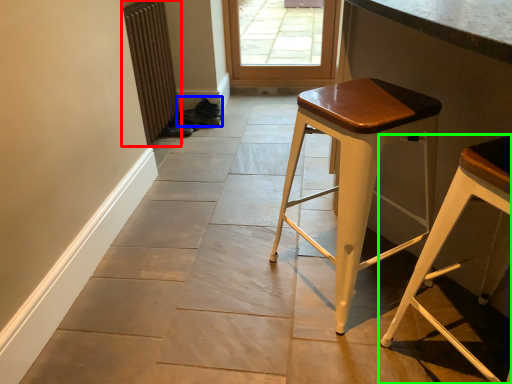
Question: Which object is the closest to the radiator (highlighted by a red box)? Choose among these: shoe (highlighted by a blue box) or stool (highlighted by a green box).

Choices:
 (A) shoe
 (B) stool

Answer: (A)